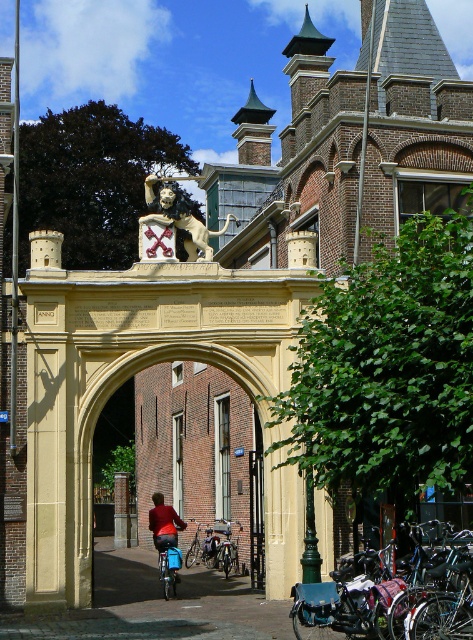
Question: Does shiny black bicycle at lower right have a lesser width compared to brushed metal bicycle at center?

Choices:
 (A) yes
 (B) no

Answer: (B)

Question: Among these points, which one is farthest from the camera?

Choices:
 (A) (150, 509)
 (B) (375, 582)

Answer: (A)

Question: Estimate the real-world distances between objects in this image. Which object is farther from the red fabric jacket at center?

Choices:
 (A) shiny metallic bicycle at center
 (B) shiny black bicycle at lower right
 (C) brick pillar at center

Answer: (B)

Question: Does brushed metal bicycle at center have a smaller size compared to shiny metallic bicycle at center?

Choices:
 (A) no
 (B) yes

Answer: (A)

Question: Among these objects, which one is nearest to the camera?

Choices:
 (A) shiny black bicycle at lower right
 (B) brick pillar at center
 (C) shiny metallic bicycle at center

Answer: (A)

Question: Can you confirm if beige stone archway at center is wider than silver metallic bicycle at center?

Choices:
 (A) no
 (B) yes

Answer: (B)